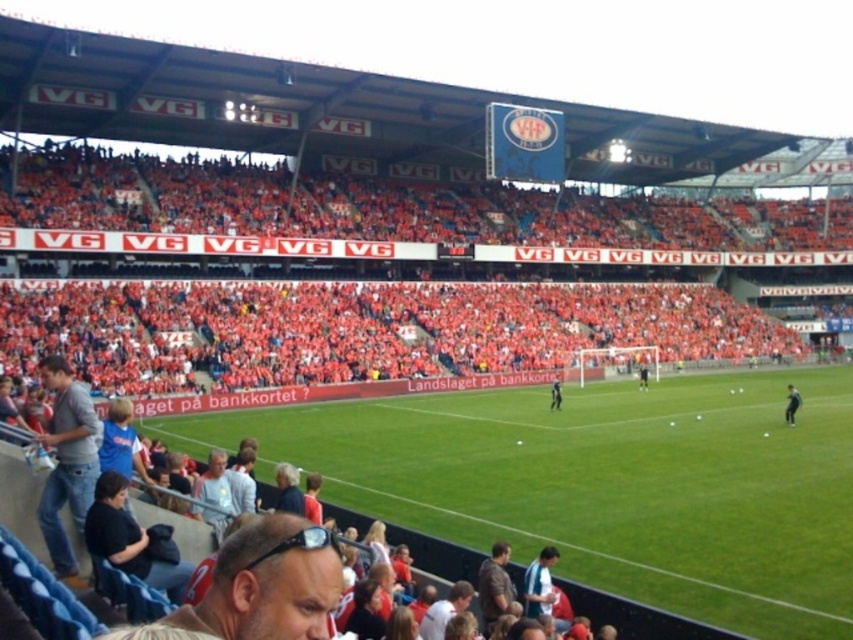
You are a photographer positioned at the center of the green grass football field at center. You want to take a photo of the orange fabric seats at upper left. In which direction should you point your camera?

The orange fabric seats at upper left are to the right of the green grass football field at center, so you should point your camera to the right to capture the orange fabric seats at upper left.

You are a photographer positioned at the center of the stadium, aiming to capture a photo that includes both the orange fabric seats at upper left and the brown leather jacket at lower center. Which object will appear larger in your photo?

The orange fabric seats at upper left will appear larger in the photo because they are closer to the viewer compared to the brown leather jacket at lower center.